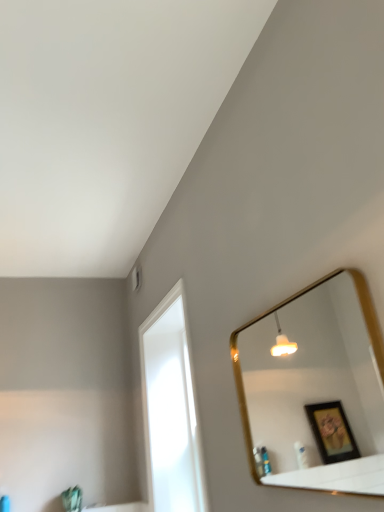
Locate an element on the screen. transparent glass window at upper left is located at coordinates pyautogui.click(x=170, y=410).

Measure the distance between transparent glass window at upper left and camera.

They are 1.72 meters apart.

What do you see at coordinates (170, 410) in the screenshot?
I see `transparent glass window at upper left` at bounding box center [170, 410].

Locate an element on the screen. gold metallic mirror at upper right is located at coordinates (316, 388).

Describe the element at coordinates (316, 388) in the screenshot. Image resolution: width=384 pixels, height=512 pixels. I see `gold metallic mirror at upper right` at that location.

The width and height of the screenshot is (384, 512). I want to click on transparent glass window at upper left, so click(170, 410).

Is gold metallic mirror at upper right at the right side of transparent glass window at upper left?

Correct, you'll find gold metallic mirror at upper right to the right of transparent glass window at upper left.

Is the position of gold metallic mirror at upper right more distant than that of transparent glass window at upper left?

No, gold metallic mirror at upper right is closer to the camera.

Which is more distant, (342, 486) or (181, 288)?

Positioned behind is point (342, 486).

From the image's perspective, is gold metallic mirror at upper right located above transparent glass window at upper left?

Yes, from the image's perspective, gold metallic mirror at upper right is on top of transparent glass window at upper left.

From a real-world perspective, which object stands above the other?

transparent glass window at upper left is physically above.

Which object is wider, gold metallic mirror at upper right or transparent glass window at upper left?

Wider between the two is transparent glass window at upper left.

Does gold metallic mirror at upper right have a greater height compared to transparent glass window at upper left?

In fact, gold metallic mirror at upper right may be shorter than transparent glass window at upper left.

Looking at the image, does gold metallic mirror at upper right seem bigger or smaller compared to transparent glass window at upper left?

gold metallic mirror at upper right is smaller than transparent glass window at upper left.

Can we say gold metallic mirror at upper right lies outside transparent glass window at upper left?

Yes, gold metallic mirror at upper right is outside of transparent glass window at upper left.

Would you consider gold metallic mirror at upper right to be distant from transparent glass window at upper left?

Yes, gold metallic mirror at upper right is far from transparent glass window at upper left.

Is gold metallic mirror at upper right facing away from transparent glass window at upper left?

No, gold metallic mirror at upper right is not facing the opposite direction of transparent glass window at upper left.

How much distance is there between gold metallic mirror at upper right and transparent glass window at upper left?

3.91 feet.

Locate an element on the screen. Image resolution: width=384 pixels, height=512 pixels. mirror lying on the right of transparent glass window at upper left is located at coordinates (316, 388).

Between transparent glass window at upper left and gold metallic mirror at upper right, which one appears on the left side from the viewer's perspective?

transparent glass window at upper left.

Does transparent glass window at upper left come in front of gold metallic mirror at upper right?

No.

Which is in front, point (161, 419) or point (279, 421)?

The point (161, 419) is closer to the camera.

From the image's perspective, is transparent glass window at upper left over gold metallic mirror at upper right?

No, from the image's perspective, transparent glass window at upper left is not above gold metallic mirror at upper right.

From a real-world perspective, is transparent glass window at upper left over gold metallic mirror at upper right?

Yes, from a real-world perspective, transparent glass window at upper left is above gold metallic mirror at upper right.

Is transparent glass window at upper left thinner than gold metallic mirror at upper right?

No, transparent glass window at upper left is not thinner than gold metallic mirror at upper right.

Is transparent glass window at upper left shorter than gold metallic mirror at upper right?

In fact, transparent glass window at upper left may be taller than gold metallic mirror at upper right.

Considering the sizes of objects transparent glass window at upper left and gold metallic mirror at upper right in the image provided, who is bigger, transparent glass window at upper left or gold metallic mirror at upper right?

transparent glass window at upper left.

Is transparent glass window at upper left completely or partially outside of gold metallic mirror at upper right?

transparent glass window at upper left is positioned outside gold metallic mirror at upper right.

Is transparent glass window at upper left in contact with gold metallic mirror at upper right?

They are not placed beside each other.

Is transparent glass window at upper left turned away from gold metallic mirror at upper right?

No, transparent glass window at upper left is not facing away from gold metallic mirror at upper right.

How many degrees apart are the facing directions of transparent glass window at upper left and gold metallic mirror at upper right?

0.0946 degrees separate the facing orientations of transparent glass window at upper left and gold metallic mirror at upper right.

Measure the distance between transparent glass window at upper left and gold metallic mirror at upper right.

A distance of 1.19 meters exists between transparent glass window at upper left and gold metallic mirror at upper right.

Locate an element on the screen. window on the left of gold metallic mirror at upper right is located at coordinates (170, 410).

I want to click on window behind the gold metallic mirror at upper right, so click(x=170, y=410).

Locate an element on the screen. mirror that is on the right side of transparent glass window at upper left is located at coordinates (316, 388).